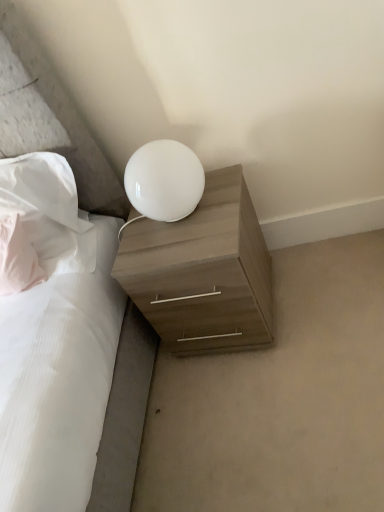
Question: In terms of height, does pink fabric pillow at left, which is counted as the first pillow, starting from the left, look taller or shorter compared to light wood/texture nightstand at lower right?

Choices:
 (A) short
 (B) tall

Answer: (A)

Question: From the image's perspective, is pink fabric pillow at left, which is counted as the first pillow, starting from the left, positioned above or below light wood/texture nightstand at lower right?

Choices:
 (A) below
 (B) above

Answer: (B)

Question: Which of these objects is positioned farthest from the white fabric pillow at upper left, arranged as the 1th pillow when viewed from the right?

Choices:
 (A) pink fabric pillow at left, acting as the second pillow starting from the right
 (B) white glossy lamp at upper center
 (C) light wood/texture nightstand at lower right

Answer: (B)

Question: Which object is positioned closest to the light wood/texture nightstand at lower right?

Choices:
 (A) pink fabric pillow at left, acting as the second pillow starting from the right
 (B) white glossy lamp at upper center
 (C) white fabric pillow at upper left, which appears as the 2th pillow when viewed from the left

Answer: (B)